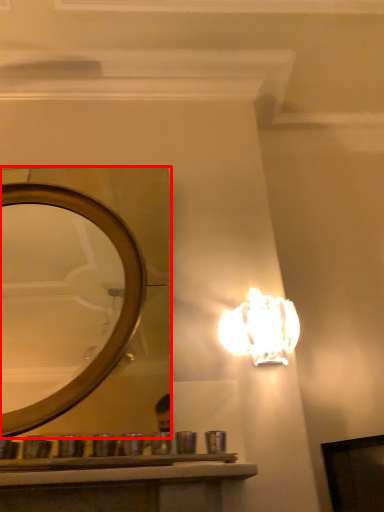
Question: Where is mirror (annotated by the red box) located in relation to lamp in the image?

Choices:
 (A) left
 (B) right

Answer: (A)